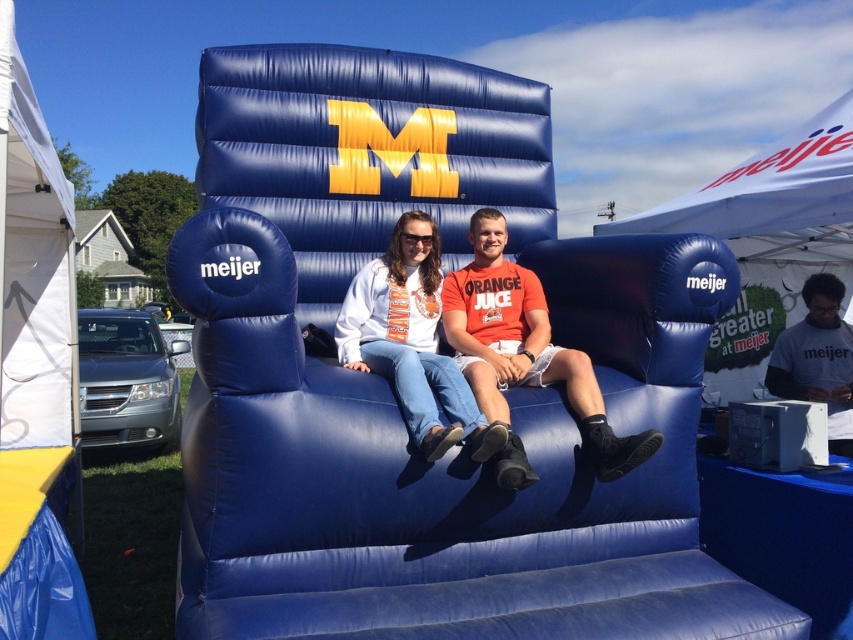
You are a photographer trying to capture the orange matte shirt at center in the image. Based on its position coordinates, where should you focus your camera lens?

The orange matte shirt at center is located at point coordinates 0.542 on the x axis and 0.615 on the y axis, so you should focus your camera lens at those coordinates to capture it.

You are a photographer trying to capture a clear shot of both the matte white shirt at center and the white matte shirt at lower right. Since you want to ensure both shirts are in focus, you need to know which one is taller. Can you tell me which shirt is taller?

The matte white shirt at center is taller than the white matte shirt at lower right according to the description.